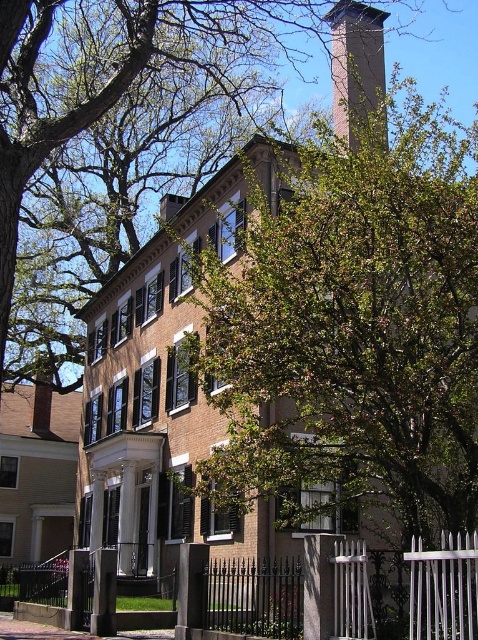
Question: Which point is closer to the camera?

Choices:
 (A) (410, 589)
 (B) (95, 132)
 (C) (369, 422)

Answer: (A)

Question: Estimate the real-world distances between objects in this image. Which object is closer to the black wrought iron fence at lower left?

Choices:
 (A) green leafy tree at upper center
 (B) green leafy tree at center
 (C) smooth brick chimney at upper center

Answer: (B)

Question: Does black wrought iron fence at lower left have a larger size compared to smooth brick chimney at upper center?

Choices:
 (A) yes
 (B) no

Answer: (A)

Question: Can you confirm if green leafy tree at center is positioned to the right of smooth brick chimney at upper center?

Choices:
 (A) yes
 (B) no

Answer: (A)

Question: Does green leafy tree at center appear over smooth brick chimney at upper center?

Choices:
 (A) no
 (B) yes

Answer: (A)

Question: Which of the following is the farthest from the observer?

Choices:
 (A) green leafy tree at upper center
 (B) smooth brick chimney at upper center
 (C) green leafy tree at center

Answer: (B)